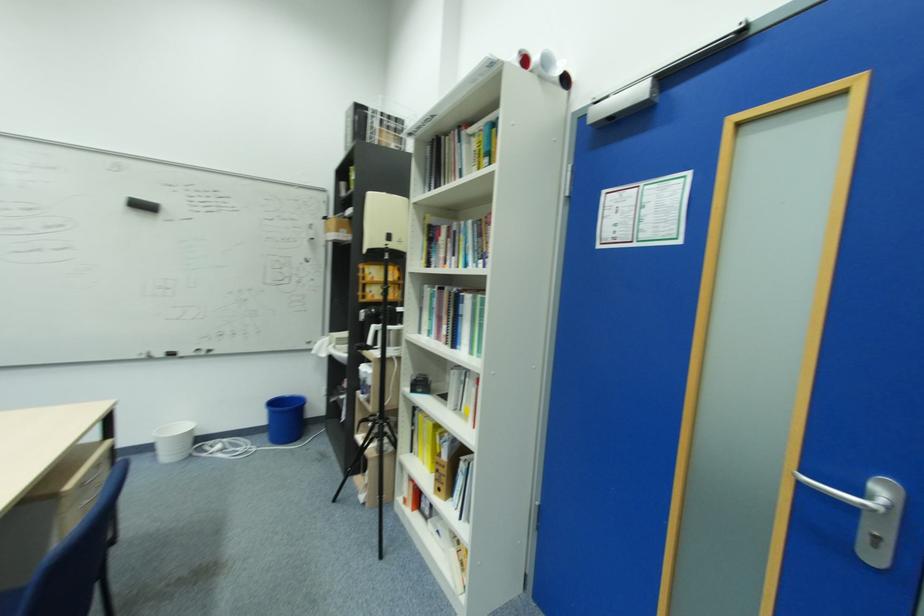
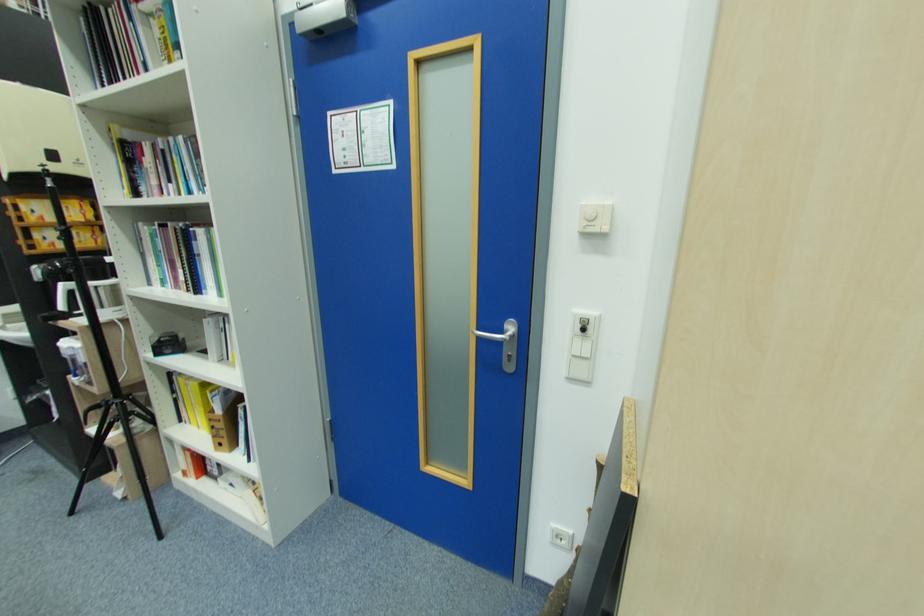
Question: How did the camera likely rotate?

Choices:
 (A) Left
 (B) Right
 (C) Up
 (D) Down

Answer: (B)